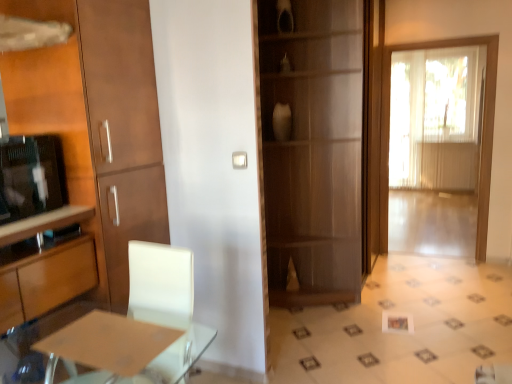
Question: In the image, is matte wood cabinet at left, marked as the second cabinetry in a bottom-to-top arrangement, positioned in front of or behind matte black television at left?

Choices:
 (A) behind
 (B) front

Answer: (A)

Question: From a real-world perspective, is matte wood cabinet at left, the first cabinetry from the top, positioned above or below matte black television at left?

Choices:
 (A) above
 (B) below

Answer: (B)

Question: Which object is the farthest from the matte brown table at lower left?

Choices:
 (A) wooden cabinet at left, positioned as the second cabinetry in top-to-bottom order
 (B) matte wood cabinet at left, marked as the second cabinetry in a bottom-to-top arrangement
 (C) wooden cabinet at center
 (D) matte black television at left
 (E) white sheer curtain at right

Answer: (E)

Question: Considering the real-world distances, which object is farthest from the wooden cabinet at center?

Choices:
 (A) wooden cabinet at left, positioned as the second cabinetry in top-to-bottom order
 (B) transparent glass door at right
 (C) white sheer curtain at right
 (D) matte brown table at lower left
 (E) matte wood cabinet at left, the first cabinetry from the top

Answer: (C)